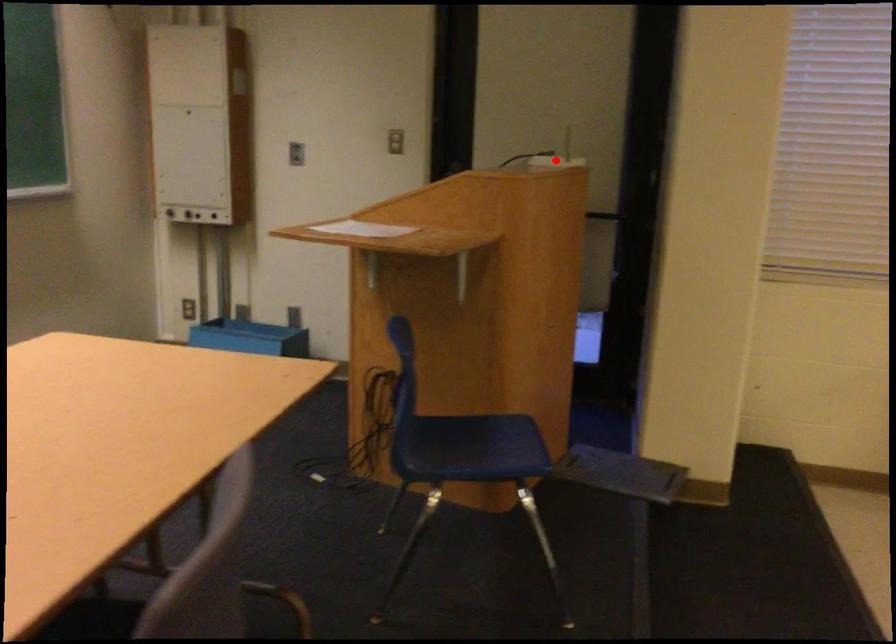
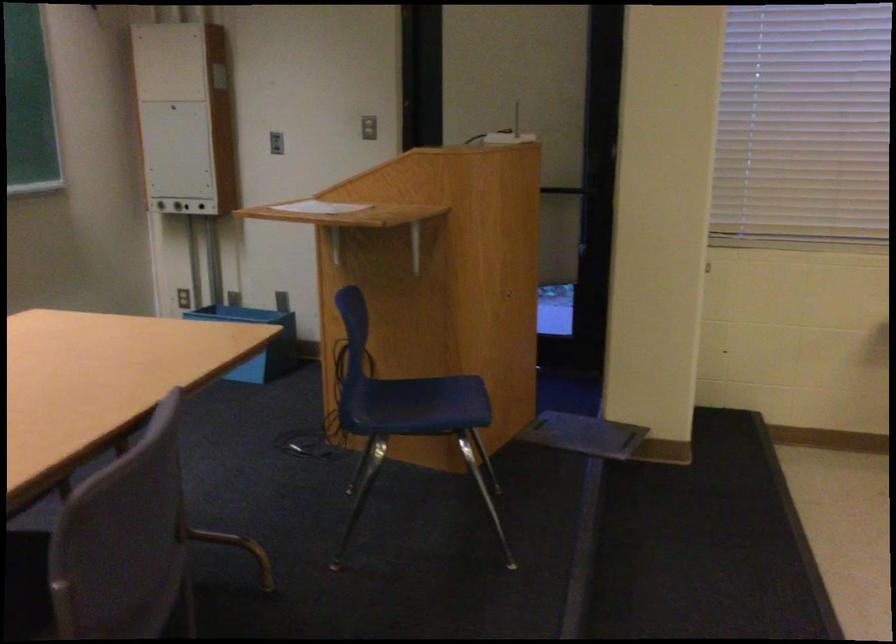
Question: I am providing you with two images of the same scene from different viewpoints. Given a red point in image1, look at the same physical point in image2. Is it:

Choices:
 (A) Closer to the viewpoint
 (B) Farther from the viewpoint

Answer: (A)